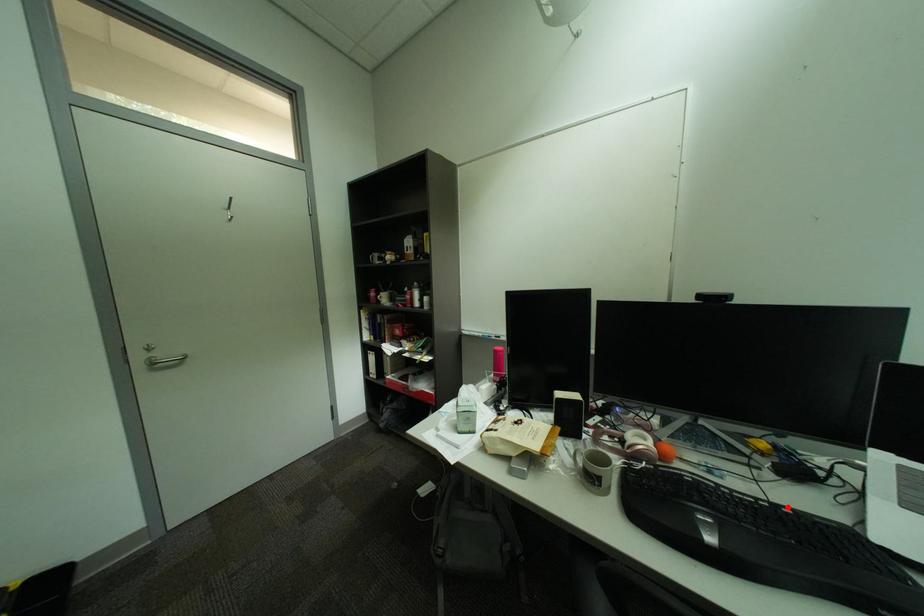
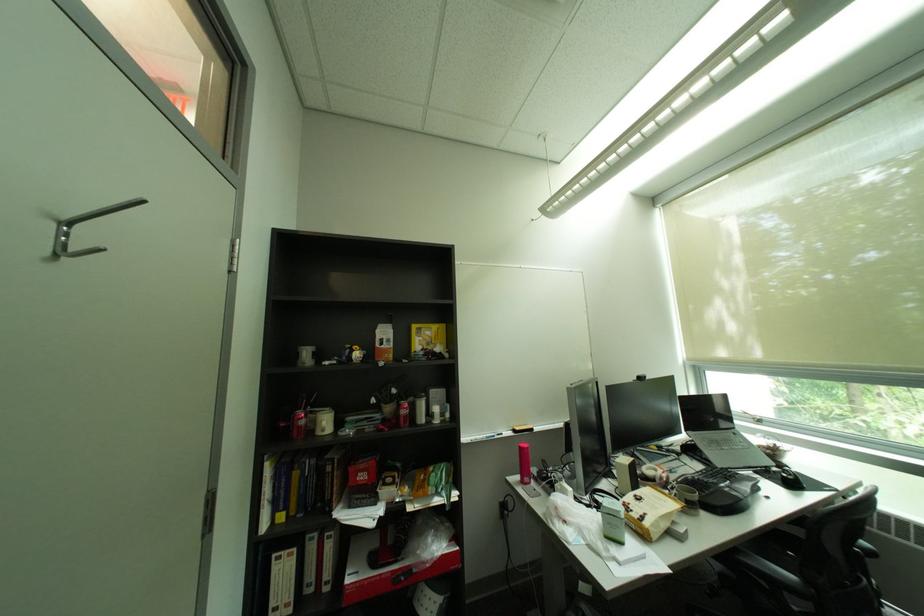
Find the pixel in the second image that matches the highlighted location in the first image.

(712, 472)